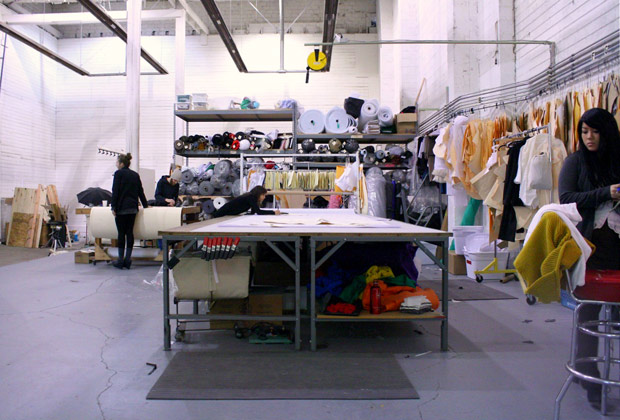
This screenshot has height=420, width=620. What are the coordinates of `white wall` in the screenshot? It's located at (105, 115).